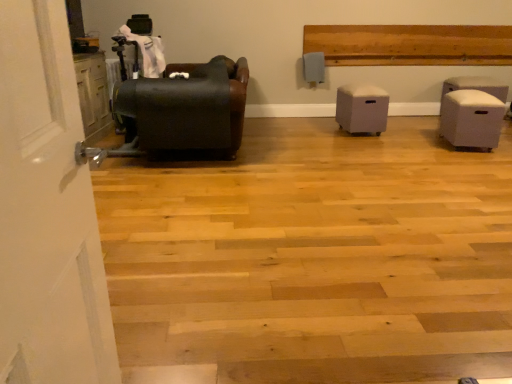
Question: Is point (367, 99) positioned closer to the camera than point (466, 107)?

Choices:
 (A) closer
 (B) farther

Answer: (B)

Question: In terms of height, does light gray fabric ottoman at center, which is the 2th furniture in right-to-left order, look taller or shorter compared to white fabric ottoman at right, marked as the 3th furniture in a left-to-right arrangement?

Choices:
 (A) tall
 (B) short

Answer: (B)

Question: Which object is the closest to the white fabric ottoman at right, the first furniture in the right-to-left sequence?

Choices:
 (A) light gray fabric ottoman at center, which is the 2th furniture in right-to-left order
 (B) matte black leather armchair at left, arranged as the first furniture when viewed from the left

Answer: (A)

Question: Estimate the real-world distances between objects in this image. Which object is closer to the matte black leather armchair at left, placed as the 3th furniture when sorted from right to left?

Choices:
 (A) light gray fabric ottoman at center, which is the 2th furniture in right-to-left order
 (B) white fabric ottoman at right, the first furniture in the right-to-left sequence

Answer: (A)